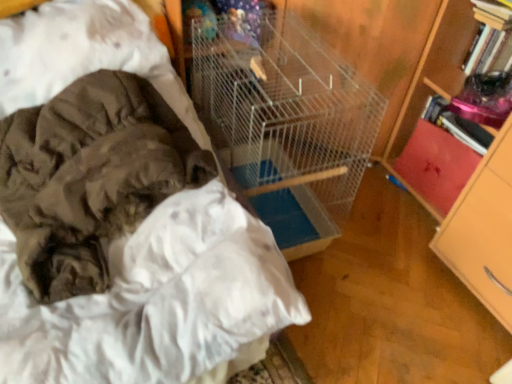
Question: Does white wire birdcage at center have a larger size compared to wooden drawer at right, the 1th drawer from the front?

Choices:
 (A) yes
 (B) no

Answer: (A)

Question: Can you confirm if white wire birdcage at center is shorter than wooden drawer at right, the 1th drawer from the front?

Choices:
 (A) no
 (B) yes

Answer: (A)

Question: Would you say white wire birdcage at center contains wooden drawer at right, the 2th drawer from the back?

Choices:
 (A) no
 (B) yes

Answer: (A)

Question: From the image's perspective, is white wire birdcage at center on wooden drawer at right, the 2th drawer from the back?

Choices:
 (A) yes
 (B) no

Answer: (A)

Question: Considering the relative sizes of white wire birdcage at center and wooden drawer at right, the 1th drawer from the front, in the image provided, is white wire birdcage at center thinner than wooden drawer at right, the 1th drawer from the front,?

Choices:
 (A) yes
 (B) no

Answer: (B)

Question: Relative to wooden bookcase at right, is red leather book at right, placed as the 1th drawer when sorted from back to front, in front or behind?

Choices:
 (A) behind
 (B) front

Answer: (A)

Question: From the image's perspective, is red leather book at right, placed as the 1th drawer when sorted from back to front, above or below wooden bookcase at right?

Choices:
 (A) below
 (B) above

Answer: (A)

Question: Based on their sizes in the image, would you say red leather book at right, placed as the 1th drawer when sorted from back to front, is bigger or smaller than wooden bookcase at right?

Choices:
 (A) small
 (B) big

Answer: (A)

Question: Is red leather book at right, placed as the 1th drawer when sorted from back to front, wider or thinner than wooden bookcase at right?

Choices:
 (A) thin
 (B) wide

Answer: (A)

Question: In terms of height, does red leather book at right, which appears as the second drawer when viewed from the front, look taller or shorter compared to camouflage fabric blanket at left?

Choices:
 (A) tall
 (B) short

Answer: (A)

Question: Considering the positions of point (445, 205) and point (7, 127), is point (445, 205) closer or farther from the camera than point (7, 127)?

Choices:
 (A) closer
 (B) farther

Answer: (B)

Question: From the image's perspective, relative to camouflage fabric blanket at left, is red leather book at right, which appears as the second drawer when viewed from the front, above or below?

Choices:
 (A) above
 (B) below

Answer: (A)

Question: Is red leather book at right, which appears as the second drawer when viewed from the front, spatially inside camouflage fabric blanket at left, or outside of it?

Choices:
 (A) outside
 (B) inside

Answer: (A)

Question: Is wooden bookcase at right in front of or behind wooden drawer at right, the 1th drawer from the front, in the image?

Choices:
 (A) front
 (B) behind

Answer: (B)

Question: Is point (425, 206) closer or farther from the camera than point (495, 278)?

Choices:
 (A) farther
 (B) closer

Answer: (A)